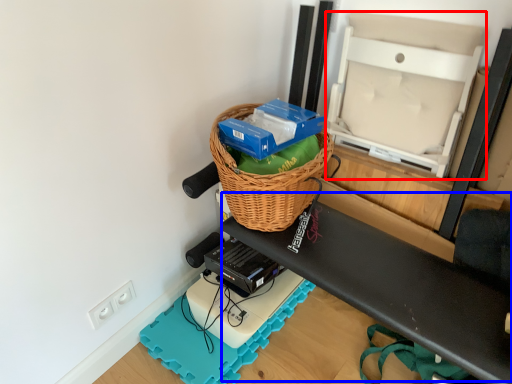
Question: Which point is closer to the camera, wide (highlighted by a red box) or wide (highlighted by a blue box)?

Choices:
 (A) wide
 (B) wide

Answer: (B)